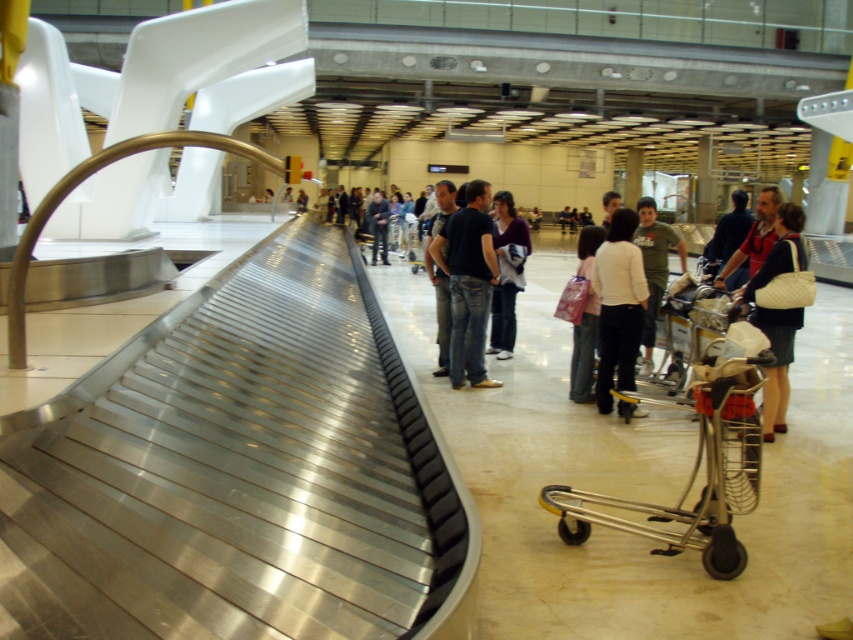
Does green t-shirt at center appear on the left side of black jeans at center?

Incorrect, green t-shirt at center is not on the left side of black jeans at center.

Which is more to the right, green t-shirt at center or black jeans at center?

Positioned to the right is green t-shirt at center.

Is point (653, 257) positioned behind point (445, 342)?

No, (653, 257) is in front of (445, 342).

The width and height of the screenshot is (853, 640). In order to click on green t-shirt at center in this screenshot , I will do `click(654, 266)`.

Which is behind, point (490, 228) or point (612, 189)?

Point (612, 189)

Between jeans at center and smooth skin face at center, which one has less height?

With less height is jeans at center.

This screenshot has width=853, height=640. Find the location of `jeans at center`. jeans at center is located at coordinates (468, 284).

The height and width of the screenshot is (640, 853). Identify the location of jeans at center. (468, 284).

Based on the photo, between dark blue shirt at center and dark blue jeans at center, which one has more height?

dark blue jeans at center is taller.

Locate an element on the screen. The width and height of the screenshot is (853, 640). dark blue shirt at center is located at coordinates (728, 230).

Which is in front, point (706, 268) or point (383, 259)?

Point (706, 268)

Find the location of `dark blue shirt at center`. dark blue shirt at center is located at coordinates (728, 230).